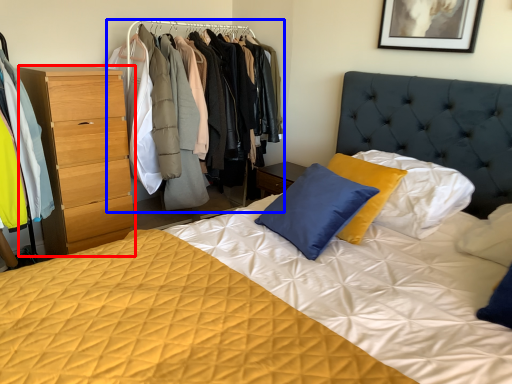
Question: Which point is closer to the camera, chest of drawers (highlighted by a red box) or dresser (highlighted by a blue box)?

Choices:
 (A) chest of drawers
 (B) dresser

Answer: (A)